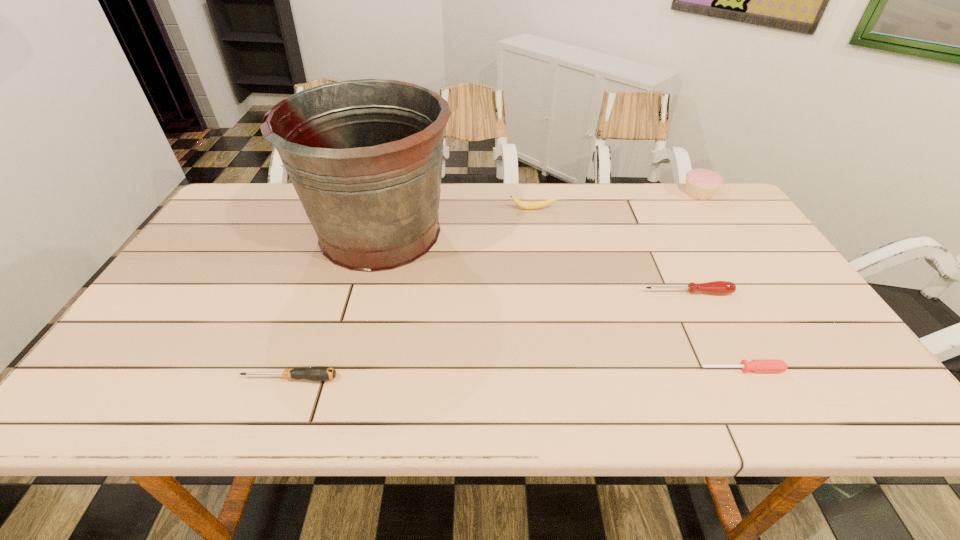
This screenshot has height=540, width=960. I want to click on object located in the far right corner section of the desktop, so click(x=701, y=184).

In order to click on vacant position at the far edge of the desktop in this screenshot , I will do `click(645, 209)`.

In the image, there is a desktop. Identify the location of vacant space at the near edge. (677, 388).

At what (x,y) coordinates should I click in order to perform the action: click on free region at the left edge of the desktop. Please return your answer as a coordinate pair (x, y). Image resolution: width=960 pixels, height=540 pixels. Looking at the image, I should click on (204, 288).

The width and height of the screenshot is (960, 540). I want to click on vacant space at the far left corner of the desktop, so click(271, 210).

Identify the location of free spot between the shortest screwdriver and the bucket. (562, 301).

Identify the location of empty location between the rightmost object and the bucket. The height and width of the screenshot is (540, 960). (540, 213).

Image resolution: width=960 pixels, height=540 pixels. Identify the location of vacant space in between the shortest screwdriver and the leftmost screwdriver. (516, 374).

The width and height of the screenshot is (960, 540). What are the coordinates of `free space between the third tallest object and the shortest object` in the screenshot? It's located at click(637, 289).

What are the coordinates of `free spot between the third nearest object and the leftmost screwdriver` in the screenshot? It's located at (489, 335).